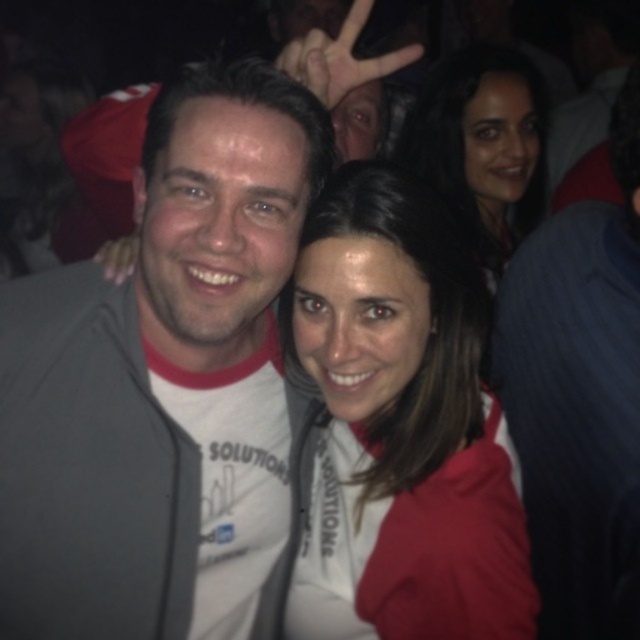
From the picture: You are a photographer at the event and want to capture a photo of both the matte white hoodie at center and the smooth dark hair at upper right. Since you need to ensure both are in focus, which object should you adjust your camera focus on first to account for their sizes?

The matte white hoodie at center is taller than the smooth dark hair at upper right, so you should focus on the matte white hoodie at center first as it is larger and requires more precise focus to ensure both are in frame and clear.

You are a photographer trying to capture a photo of both the gray fabric jacket at center and the matte white hoodie at center. Since you want both subjects to be clearly visible, which jacket should you focus on first to ensure the best depth of field?

You should focus on the gray fabric jacket at center first because it is closer to the viewer than the matte white hoodie at center, ensuring that it remains sharp while the background stays in focus.